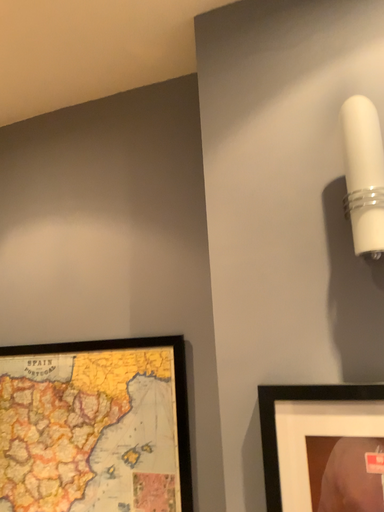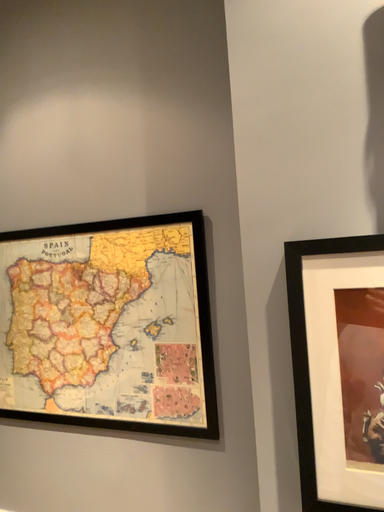
Question: How did the camera likely rotate when shooting the video?

Choices:
 (A) rotated upward
 (B) rotated downward

Answer: (B)